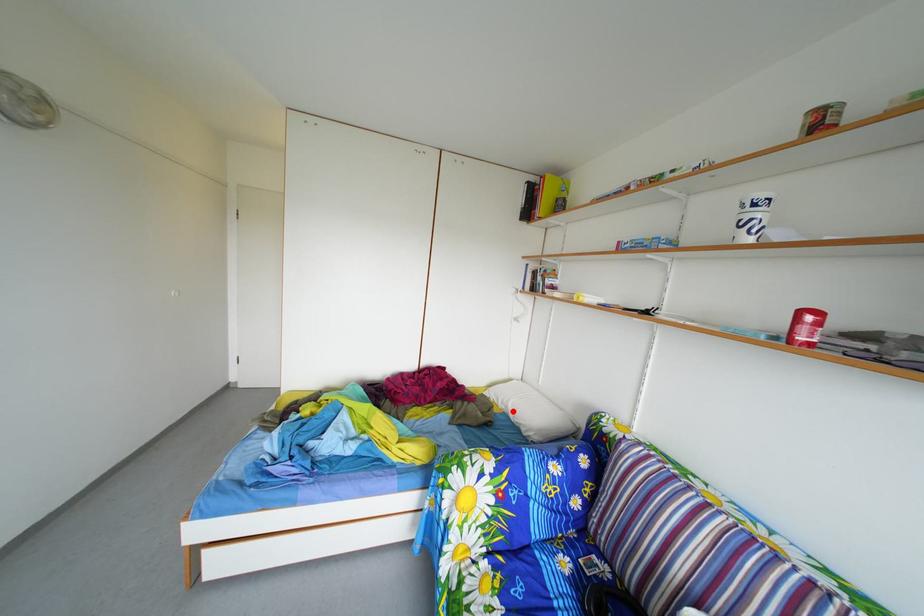
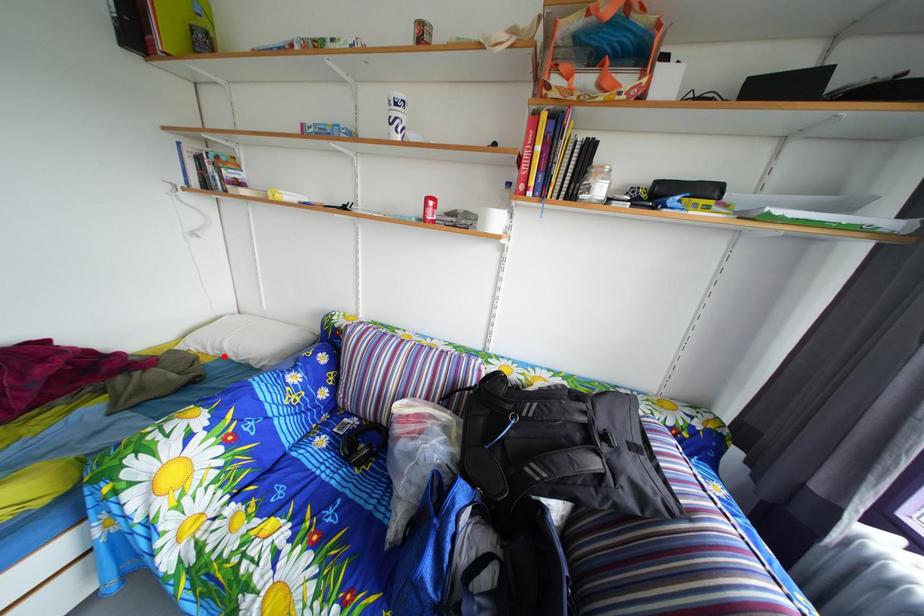
I am providing you with two images of the same scene from different viewpoints. A red point is marked on the first image and another point is marked on the second image. Is the red point in image1 aligned with the point shown in image2?

Yes